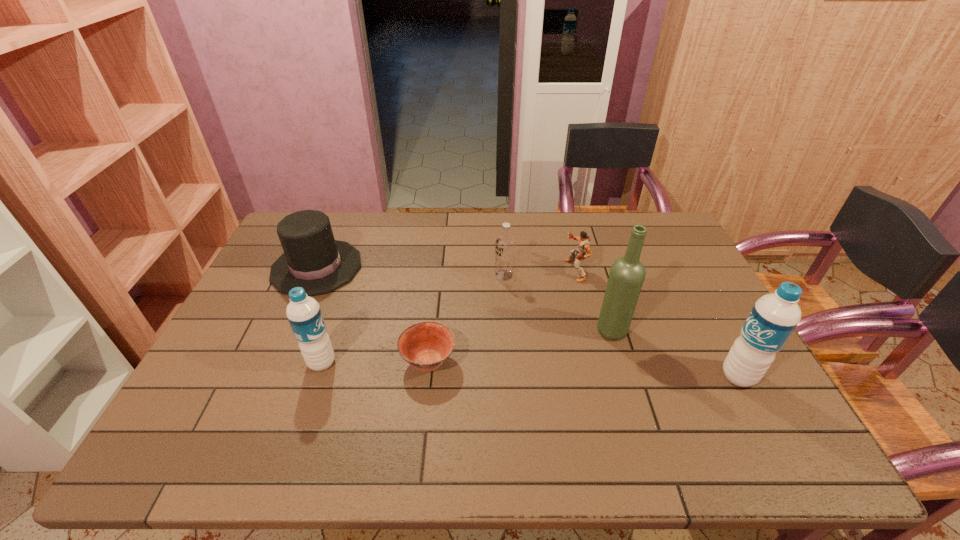
The height and width of the screenshot is (540, 960). What are the coordinates of `vacant area situated 0.200m on the label of the shorter water bottle` in the screenshot? It's located at (414, 363).

Identify the location of free space located 0.290m on the label of the taller water bottle. The image size is (960, 540). (605, 376).

At what (x,y) coordinates should I click in order to perform the action: click on free space located 0.310m on the label of the taller water bottle. Please return your answer as a coordinate pair (x, y). Looking at the image, I should click on click(x=597, y=376).

Where is `vacant position located on the label of the taller water bottle`? vacant position located on the label of the taller water bottle is located at coordinates (636, 376).

The width and height of the screenshot is (960, 540). I want to click on vacant space located on the left of the wine bottle, so click(x=520, y=330).

The width and height of the screenshot is (960, 540). Find the location of `vacant position located on the front of the dress hat with the decoration`. vacant position located on the front of the dress hat with the decoration is located at coordinates (439, 267).

The height and width of the screenshot is (540, 960). Identify the location of free point located 0.240m on the front-facing side of the puncher. (490, 271).

Identify the location of free location located 0.340m on the front-facing side of the puncher. (459, 271).

This screenshot has width=960, height=540. In order to click on vacant space located 0.160m on the front-facing side of the puncher in this screenshot , I will do `click(515, 271)`.

At what (x,y) coordinates should I click in order to perform the action: click on vacant space located on the front label of the fourth object from right to left. Please return your answer as a coordinate pair (x, y). Looking at the image, I should click on (374, 275).